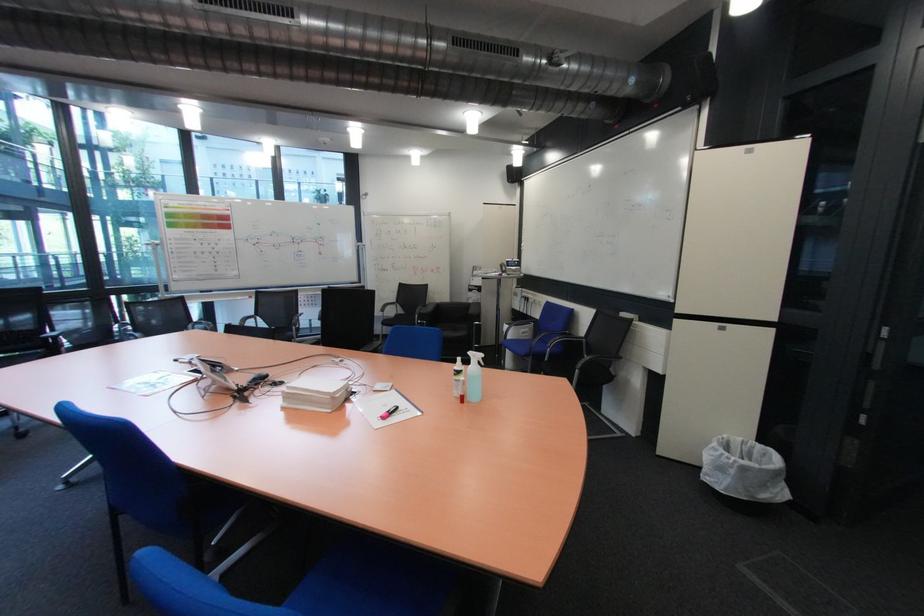
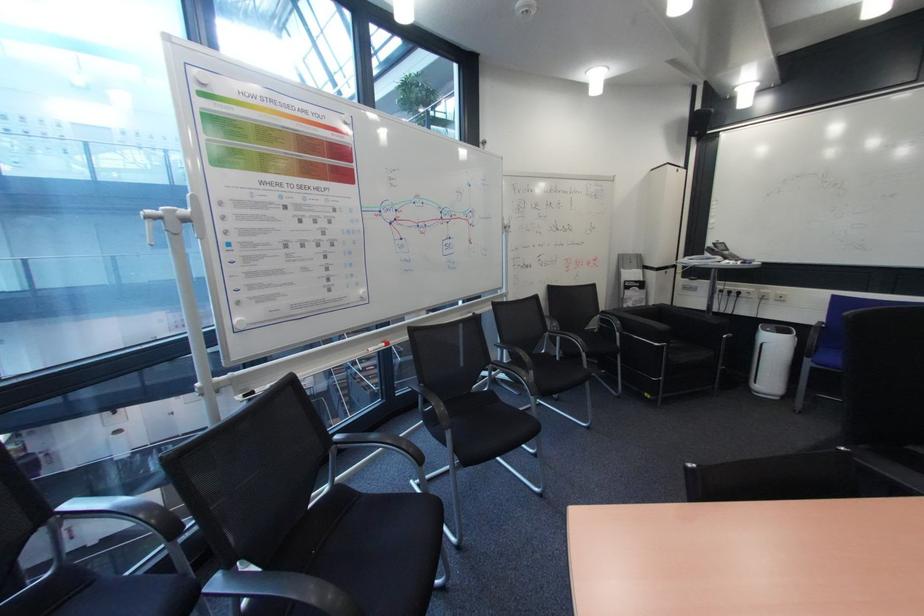
The images are taken continuously from a first-person perspective. In which direction are you moving?

The movement direction of the cameraman is left, forward.